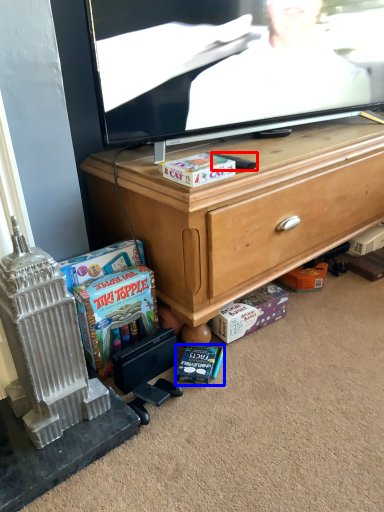
Question: Among these objects, which one is nearest to the camera, remote control (highlighted by a red box) or book (highlighted by a blue box)?

Choices:
 (A) remote control
 (B) book

Answer: (B)